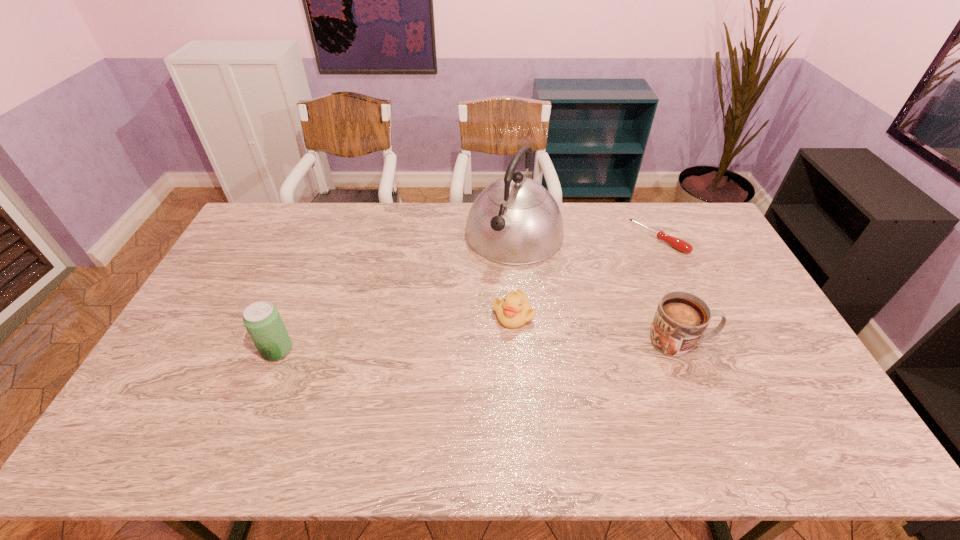
Where is `free space in the image that satisfies the following two spatial constraints: 1. on the back side of the mug; 2. on the side of the leftmost object with the handle`? free space in the image that satisfies the following two spatial constraints: 1. on the back side of the mug; 2. on the side of the leftmost object with the handle is located at coordinates (280, 342).

Identify the location of free region that satisfies the following two spatial constraints: 1. on the front side of the mug; 2. on the side of the kettle with the handle. This screenshot has width=960, height=540. (524, 342).